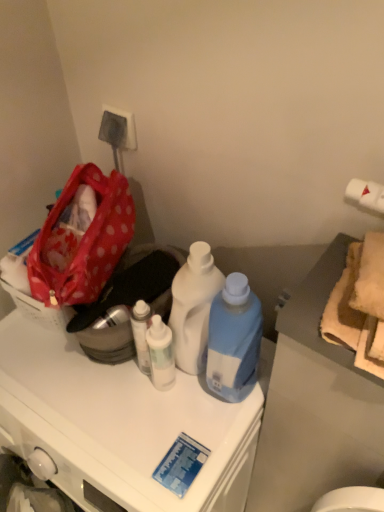
What are the coordinates of `free space that is to the left of white plastic bottle at center, marked as the second bottle in a right-to-left arrangement` in the screenshot? It's located at (94, 396).